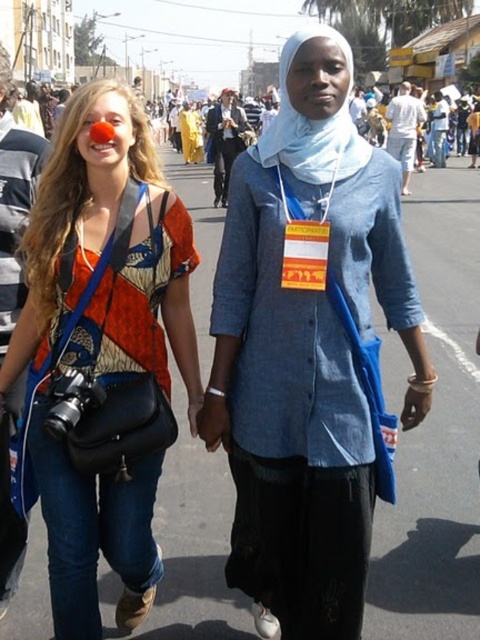
From the picture: You are a photographer trying to capture a clear shot of the white fabric scarf at center. However, the matte black camera at center is blocking your view. Can you move the camera to the side to get an unobstructed view of the scarf?

The matte black camera at center is in front of the white fabric scarf at center, so moving the camera to the side would allow you to see the scarf without obstruction.

Based on the photo, you are standing at the origin point in the image. You see two points marked as point 1 at coordinates point (101, 81) and point 2 at coordinates point (269, 157). Which point is closer to you?

Point 2 at coordinates point (269, 157) is closer to you because point 1 at coordinates point (101, 81) is behind it.

You are a photographer trying to capture a candid shot of the two people in the image. You want to ensure that both the blue denim shirt at center and the white fabric scarf at center are clearly visible in the frame. Based on their sizes, which object should you focus on to ensure both are in focus?

The blue denim shirt at center is larger than the white fabric scarf at center, so focusing on the blue denim shirt at center will ensure both are in focus since it covers a bigger area.